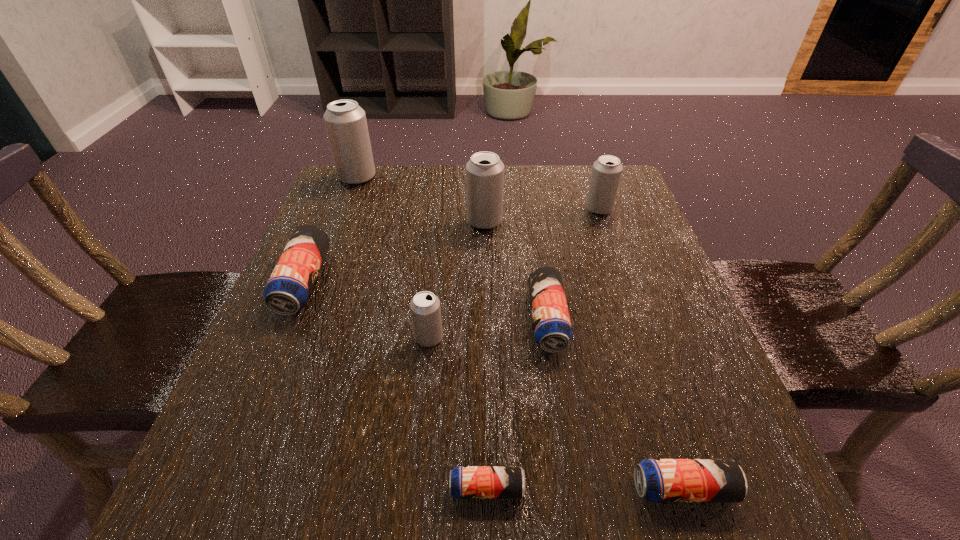
Image resolution: width=960 pixels, height=540 pixels. I want to click on the farthest beer can, so click(345, 121).

Locate an element on the screen. the leftmost white beer can is located at coordinates (345, 121).

What are the coordinates of `the third white beer can from left to right` in the screenshot? It's located at (484, 171).

This screenshot has height=540, width=960. Identify the location of the seventh shortest beer can. (484, 171).

I want to click on the rightmost white beer can, so click(x=606, y=173).

I want to click on the third tallest object, so click(606, 173).

Locate an element on the screen. The width and height of the screenshot is (960, 540). the second white beer can from left to right is located at coordinates (425, 308).

The width and height of the screenshot is (960, 540). I want to click on the sixth beer can from right to left, so click(425, 308).

Locate an element on the screen. The height and width of the screenshot is (540, 960). the leftmost blue beer can is located at coordinates (288, 289).

Where is `the biggest blue beer can`? the biggest blue beer can is located at coordinates (288, 289).